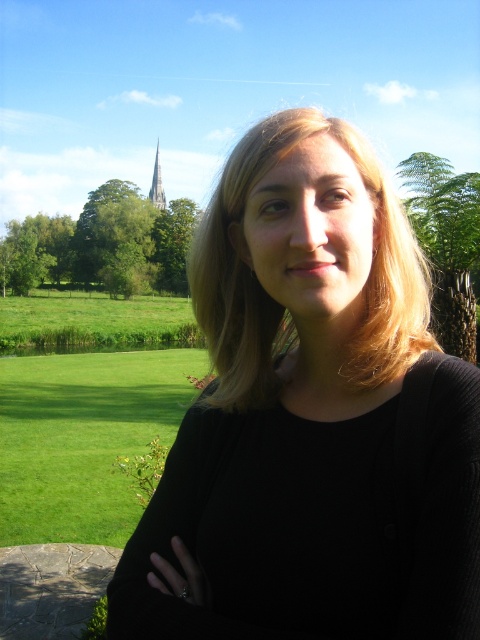
Can you confirm if blonde smooth hair at center is positioned to the left of green leafy tree at right?

Correct, you'll find blonde smooth hair at center to the left of green leafy tree at right.

Is blonde smooth hair at center shorter than green leafy tree at right?

Yes, blonde smooth hair at center is shorter than green leafy tree at right.

I want to click on blonde smooth hair at center, so [x=283, y=305].

This screenshot has width=480, height=640. I want to click on blonde smooth hair at center, so click(283, 305).

At what (x,y) coordinates should I click in order to perform the action: click on green leafy tree at upper left. Please return your answer as a coordinate pair (x, y). Looking at the image, I should click on (103, 243).

Does green leafy tree at upper left appear under green stone spire at upper left?

Yes.

In order to click on green leafy tree at upper left in this screenshot , I will do `click(103, 243)`.

The width and height of the screenshot is (480, 640). Identify the location of black fabric arm at center. (168, 541).

Does black fabric arm at center have a lesser height compared to green leafy tree at right?

Yes, black fabric arm at center is shorter than green leafy tree at right.

Where is `black fabric arm at center`? The width and height of the screenshot is (480, 640). black fabric arm at center is located at coordinates (168, 541).